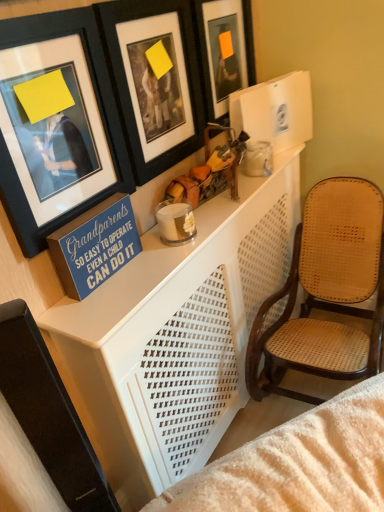
In order to face blue painted wood sign at upper left, should I rotate leftwards or rightwards?

Turn left by 12.534 degrees to look at blue painted wood sign at upper left.

Describe the element at coordinates (224, 51) in the screenshot. I see `orange matte picture frame at upper center, the 3th picture frame in the left-to-right sequence` at that location.

This screenshot has width=384, height=512. Find the location of `matte black picture frame at upper left, marked as the first picture frame in a left-to-right arrangement`. matte black picture frame at upper left, marked as the first picture frame in a left-to-right arrangement is located at coordinates (56, 124).

This screenshot has height=512, width=384. In order to click on black matte picture frame at upper center, the second picture frame in the left-to-right sequence in this screenshot , I will do `click(154, 81)`.

Locate an element on the screen. the 1st picture frame behind the blue painted wood sign at upper left, starting your count from the anchor is located at coordinates [x=154, y=81].

Is black matte picture frame at upper center, the second picture frame in the left-to-right sequence, next to blue painted wood sign at upper left?

black matte picture frame at upper center, the second picture frame in the left-to-right sequence, and blue painted wood sign at upper left are not in contact.

Considering the sizes of objects black matte picture frame at upper center, the 2th picture frame when ordered from right to left, and blue painted wood sign at upper left in the image provided, who is wider, black matte picture frame at upper center, the 2th picture frame when ordered from right to left, or blue painted wood sign at upper left?

With larger width is blue painted wood sign at upper left.

Would you consider orange matte picture frame at upper center, acting as the 1th picture frame starting from the right, to be distant from matte black picture frame at upper left, marked as the first picture frame in a left-to-right arrangement?

orange matte picture frame at upper center, acting as the 1th picture frame starting from the right, is actually quite close to matte black picture frame at upper left, marked as the first picture frame in a left-to-right arrangement.

Can you confirm if orange matte picture frame at upper center, the 3th picture frame in the left-to-right sequence, is positioned to the right of matte black picture frame at upper left, acting as the third picture frame starting from the right?

Correct, you'll find orange matte picture frame at upper center, the 3th picture frame in the left-to-right sequence, to the right of matte black picture frame at upper left, acting as the third picture frame starting from the right.

Is orange matte picture frame at upper center, acting as the 1th picture frame starting from the right, wider or thinner than matte black picture frame at upper left, marked as the first picture frame in a left-to-right arrangement?

Clearly, orange matte picture frame at upper center, acting as the 1th picture frame starting from the right, has less width compared to matte black picture frame at upper left, marked as the first picture frame in a left-to-right arrangement.

Does blue painted wood sign at upper left have a lesser height compared to white perforated table at center?

Incorrect, the height of blue painted wood sign at upper left does not fall short of that of white perforated table at center.

Considering the positions of objects blue painted wood sign at upper left and white perforated table at center in the image provided, who is more to the left, blue painted wood sign at upper left or white perforated table at center?

Positioned to the left is blue painted wood sign at upper left.

Locate an element on the screen. This screenshot has height=512, width=384. table that is under the blue painted wood sign at upper left (from a real-world perspective) is located at coordinates (179, 333).

Based on the photo, from a real-world perspective, which is physically above, blue painted wood sign at upper left or white perforated table at center?

blue painted wood sign at upper left is physically above.

Is white perforated table at center at the back of black matte picture frame at upper center, the 2th picture frame when ordered from right to left?

No, black matte picture frame at upper center, the 2th picture frame when ordered from right to left, is not facing the opposite direction of white perforated table at center.

Is black matte picture frame at upper center, the second picture frame in the left-to-right sequence, in front of white perforated table at center?

That is False.

How far apart are black matte picture frame at upper center, the 2th picture frame when ordered from right to left, and white perforated table at center?

black matte picture frame at upper center, the 2th picture frame when ordered from right to left, is 18.51 inches from white perforated table at center.

From a real-world perspective, is black matte picture frame at upper center, the 2th picture frame when ordered from right to left, on white perforated table at center?

Correct, in the physical world, black matte picture frame at upper center, the 2th picture frame when ordered from right to left, is higher than white perforated table at center.

Is white perforated table at center bigger than matte black picture frame at upper left, marked as the first picture frame in a left-to-right arrangement?

Yes.

Choose the correct answer: Is white perforated table at center inside matte black picture frame at upper left, acting as the third picture frame starting from the right, or outside it?

white perforated table at center is not inside matte black picture frame at upper left, acting as the third picture frame starting from the right, it's outside.

Is white perforated table at center turned away from matte black picture frame at upper left, acting as the third picture frame starting from the right?

No, white perforated table at center's orientation is not away from matte black picture frame at upper left, acting as the third picture frame starting from the right.

The height and width of the screenshot is (512, 384). Find the location of `the 2nd picture frame to the left when counting from the white perforated table at center`. the 2nd picture frame to the left when counting from the white perforated table at center is located at coordinates (56, 124).

Can you tell me how much orange matte picture frame at upper center, the 3th picture frame in the left-to-right sequence, and blue painted wood sign at upper left differ in facing direction?

They differ by 1.5 degrees in their facing directions.

Does orange matte picture frame at upper center, the 3th picture frame in the left-to-right sequence, come in front of blue painted wood sign at upper left?

No, orange matte picture frame at upper center, the 3th picture frame in the left-to-right sequence, is further to the viewer.

From a real-world perspective, between orange matte picture frame at upper center, acting as the 1th picture frame starting from the right, and blue painted wood sign at upper left, who is vertically lower?

blue painted wood sign at upper left, from a real-world perspective.

Is the position of white perforated table at center more distant than that of black matte picture frame at upper center, the 2th picture frame when ordered from right to left?

No.

From a real-world perspective, is white perforated table at center on black matte picture frame at upper center, the 2th picture frame when ordered from right to left?

Incorrect, from a real-world perspective, white perforated table at center is lower than black matte picture frame at upper center, the 2th picture frame when ordered from right to left.

Does white perforated table at center turn towards black matte picture frame at upper center, the second picture frame in the left-to-right sequence?

No, white perforated table at center does not turn towards black matte picture frame at upper center, the second picture frame in the left-to-right sequence.

Which of these two, white perforated table at center or black matte picture frame at upper center, the 2th picture frame when ordered from right to left, is thinner?

black matte picture frame at upper center, the 2th picture frame when ordered from right to left, is thinner.

Where is `picture frame that is the 1st object located behind the blue painted wood sign at upper left`? picture frame that is the 1st object located behind the blue painted wood sign at upper left is located at coordinates (154, 81).

Where is `picture frame that is the 2nd object to the left of the orange matte picture frame at upper center, the 3th picture frame in the left-to-right sequence, starting at the anchor`? The image size is (384, 512). picture frame that is the 2nd object to the left of the orange matte picture frame at upper center, the 3th picture frame in the left-to-right sequence, starting at the anchor is located at coordinates (56, 124).

Looking at the image, which one is located further to blue painted wood sign at upper left, black matte picture frame at upper center, the 2th picture frame when ordered from right to left, or orange matte picture frame at upper center, the 3th picture frame in the left-to-right sequence?

orange matte picture frame at upper center, the 3th picture frame in the left-to-right sequence.

Looking at the image, which one is located closer to white perforated table at center, matte black picture frame at upper left, acting as the third picture frame starting from the right, or black matte picture frame at upper center, the 2th picture frame when ordered from right to left?

Among the two, matte black picture frame at upper left, acting as the third picture frame starting from the right, is located nearer to white perforated table at center.

Considering their positions, is orange matte picture frame at upper center, the 3th picture frame in the left-to-right sequence, positioned closer to white perforated table at center than black matte picture frame at upper center, the second picture frame in the left-to-right sequence?

Based on the image, black matte picture frame at upper center, the second picture frame in the left-to-right sequence, appears to be nearer to white perforated table at center.

From the image, which object appears to be farther from black matte picture frame at upper center, the second picture frame in the left-to-right sequence, matte black picture frame at upper left, marked as the first picture frame in a left-to-right arrangement, or orange matte picture frame at upper center, acting as the 1th picture frame starting from the right?

The object further to black matte picture frame at upper center, the second picture frame in the left-to-right sequence, is orange matte picture frame at upper center, acting as the 1th picture frame starting from the right.

Based on their spatial positions, is orange matte picture frame at upper center, acting as the 1th picture frame starting from the right, or matte black picture frame at upper left, acting as the third picture frame starting from the right, further from blue painted wood sign at upper left?

orange matte picture frame at upper center, acting as the 1th picture frame starting from the right, is further to blue painted wood sign at upper left.

Based on their spatial positions, is black matte picture frame at upper center, the second picture frame in the left-to-right sequence, or blue painted wood sign at upper left closer to white perforated table at center?

blue painted wood sign at upper left lies closer to white perforated table at center than the other object.

Which object lies nearer to the anchor point orange matte picture frame at upper center, the 3th picture frame in the left-to-right sequence, blue painted wood sign at upper left or black matte picture frame at upper center, the 2th picture frame when ordered from right to left?

black matte picture frame at upper center, the 2th picture frame when ordered from right to left, is closer to orange matte picture frame at upper center, the 3th picture frame in the left-to-right sequence.

Considering their positions, is matte black picture frame at upper left, marked as the first picture frame in a left-to-right arrangement, positioned closer to orange matte picture frame at upper center, the 3th picture frame in the left-to-right sequence, than blue painted wood sign at upper left?

matte black picture frame at upper left, marked as the first picture frame in a left-to-right arrangement, is positioned closer to the anchor orange matte picture frame at upper center, the 3th picture frame in the left-to-right sequence.

Where is `picture frame located between matte black picture frame at upper left, marked as the first picture frame in a left-to-right arrangement, and orange matte picture frame at upper center, the 3th picture frame in the left-to-right sequence, in the depth direction`? picture frame located between matte black picture frame at upper left, marked as the first picture frame in a left-to-right arrangement, and orange matte picture frame at upper center, the 3th picture frame in the left-to-right sequence, in the depth direction is located at coordinates (154, 81).

This screenshot has height=512, width=384. In order to click on picture frame between black matte picture frame at upper center, the 2th picture frame when ordered from right to left, and white perforated table at center vertically in this screenshot , I will do `click(56, 124)`.

Identify the location of table that lies between orange matte picture frame at upper center, the 3th picture frame in the left-to-right sequence, and blue painted wood sign at upper left from top to bottom. (179, 333).

What are the coordinates of `picture frame between black matte picture frame at upper center, the second picture frame in the left-to-right sequence, and blue painted wood sign at upper left vertically` in the screenshot? It's located at (56, 124).